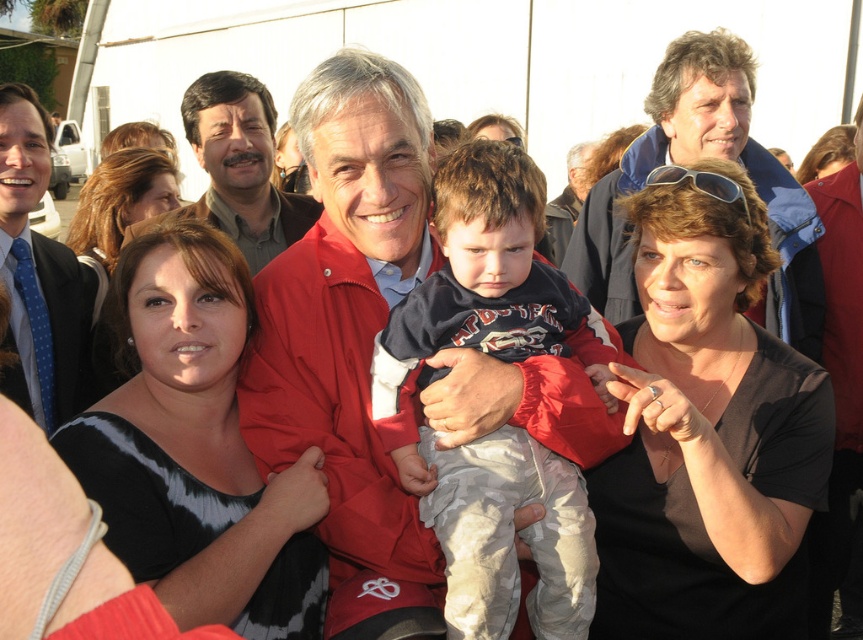
You are a photographer trying to capture a candid shot of the blue dotted tie at left and the sunglasses at upper center. Which object should you zoom in on to ensure both are in focus without moving your camera position?

The blue dotted tie at left is wider than the sunglasses at upper center, so you should zoom in on the sunglasses at upper center to ensure both are in focus without moving your camera position.

You are standing in the scene and want to greet the person wearing the matte brown shirt at center. Which direction should you walk to reach them from the blue denim jacket at upper right?

The blue denim jacket at upper right is to the right of the matte brown shirt at center, so to reach the matte brown shirt at center from the blue denim jacket at upper right, you should walk to the left.